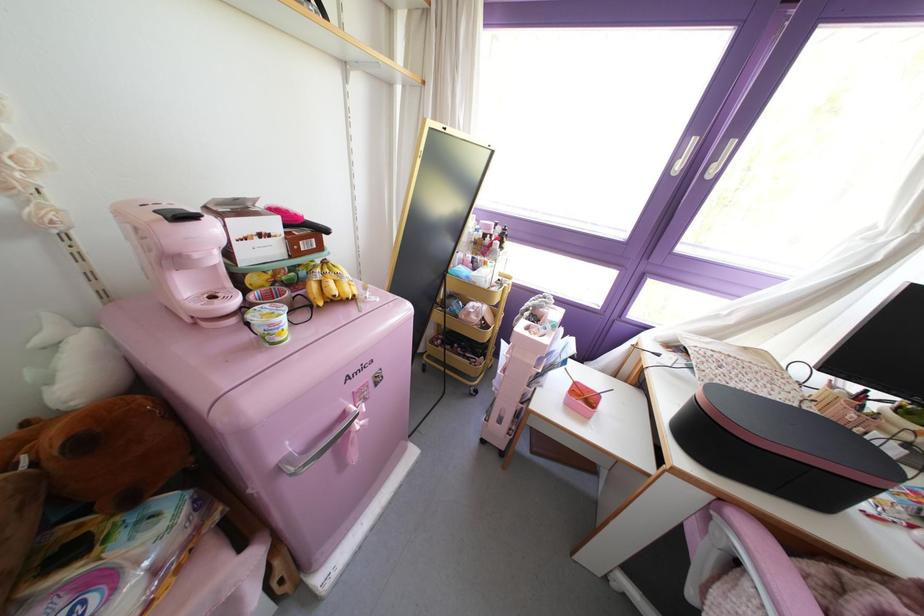
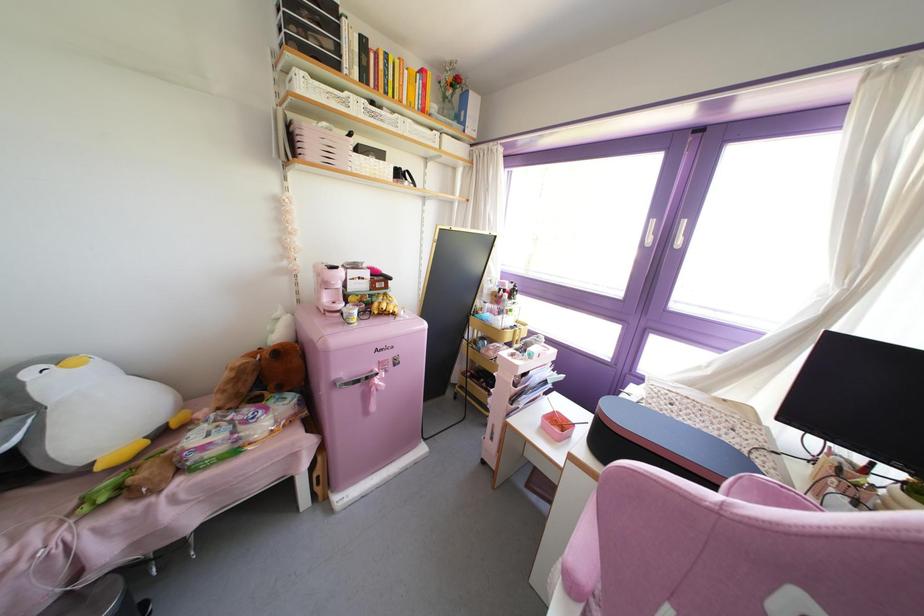
The point at (363, 399) is marked in the first image. Where is the corresponding point in the second image?

(385, 371)